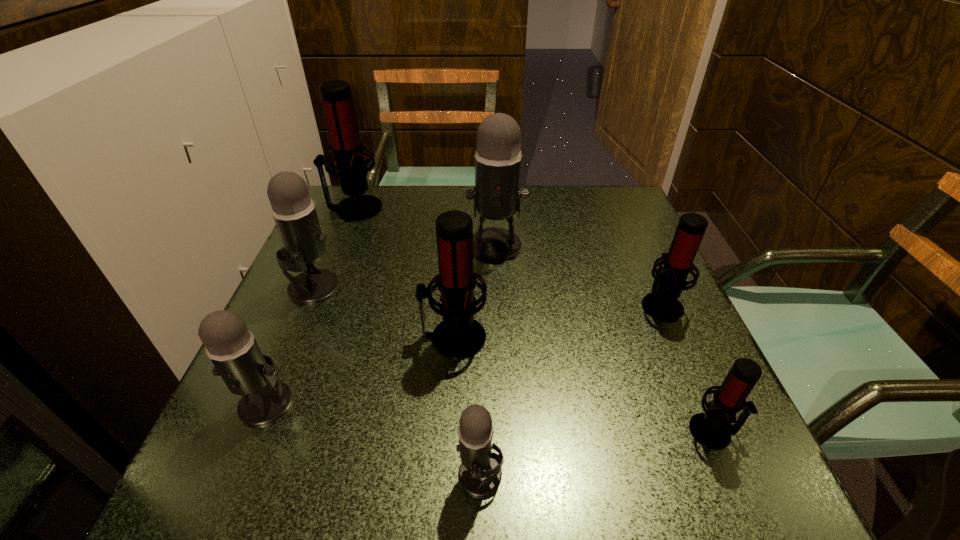
The image size is (960, 540). In order to click on object positioned at the near right corner in this screenshot , I will do `click(712, 429)`.

Find the location of a particular element. free space at the far edge of the desktop is located at coordinates (531, 228).

In the image, there is a desktop. Identify the location of vacant region at the near edge. This screenshot has height=540, width=960. (440, 489).

Locate an element on the screen. The width and height of the screenshot is (960, 540). vacant space at the left edge of the desktop is located at coordinates (302, 407).

Image resolution: width=960 pixels, height=540 pixels. Find the location of `vacant space at the right edge of the desktop`. vacant space at the right edge of the desktop is located at coordinates (663, 404).

In the image, there is a desktop. Where is `vacant area at the far right corner`? This screenshot has height=540, width=960. vacant area at the far right corner is located at coordinates (593, 228).

Identify the location of vacant space that's between the third biggest red microphone and the third smallest gray microphone. This screenshot has height=540, width=960. (487, 295).

Identify the location of free space between the second smallest gray microphone and the second farthest object. Image resolution: width=960 pixels, height=540 pixels. (381, 324).

Where is `blank region between the third biggest red microphone and the third red microphone from right to left`? blank region between the third biggest red microphone and the third red microphone from right to left is located at coordinates pyautogui.click(x=557, y=321).

Locate an element on the screen. Image resolution: width=960 pixels, height=540 pixels. free space between the leftmost red microphone and the smallest red microphone is located at coordinates (534, 320).